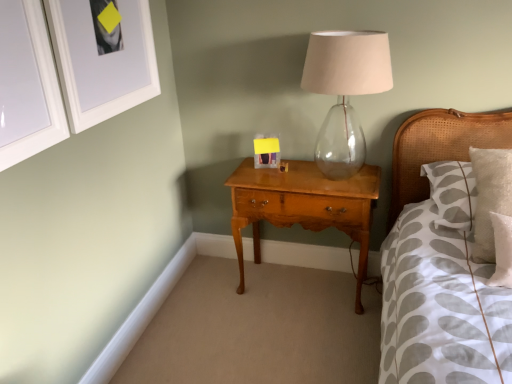
Where is `vacant space situated on the left part of matte plastic picture frame at center, marked as the 1th picture frame in a back-to-front arrangement`? The image size is (512, 384). vacant space situated on the left part of matte plastic picture frame at center, marked as the 1th picture frame in a back-to-front arrangement is located at coordinates (247, 172).